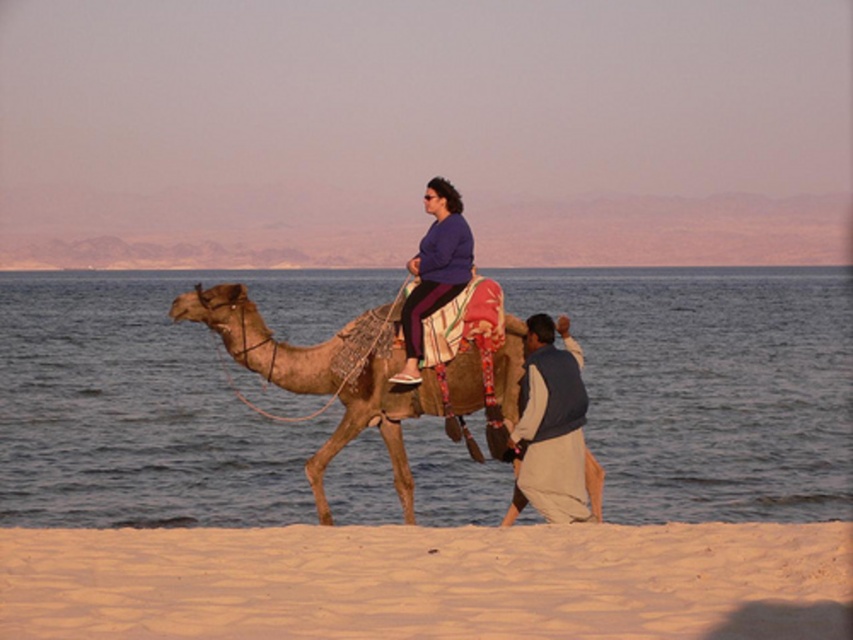
Which of these two, sandy beige at lower center or purple fabric at center, stands shorter?

sandy beige at lower center

The height and width of the screenshot is (640, 853). I want to click on sandy beige at lower center, so click(x=428, y=582).

Describe the element at coordinates (428, 582) in the screenshot. I see `sandy beige at lower center` at that location.

The height and width of the screenshot is (640, 853). I want to click on sandy beige at lower center, so click(x=428, y=582).

Is smooth sand at lower center to the right of purple fabric at center from the viewer's perspective?

In fact, smooth sand at lower center is to the left of purple fabric at center.

Which of these two, smooth sand at lower center or purple fabric at center, stands taller?

With more height is smooth sand at lower center.

Looking at this image, measure the distance between smooth sand at lower center and camera.

The distance of smooth sand at lower center from camera is 26.76 meters.

Image resolution: width=853 pixels, height=640 pixels. I want to click on smooth sand at lower center, so point(151,401).

Can you confirm if beige cotton pants at lower right is positioned to the left of purple fabric at center?

In fact, beige cotton pants at lower right is to the right of purple fabric at center.

In order to click on beige cotton pants at lower right in this screenshot , I will do `click(550, 426)`.

What do you see at coordinates (550, 426) in the screenshot? I see `beige cotton pants at lower right` at bounding box center [550, 426].

This screenshot has width=853, height=640. What are the coordinates of `beige cotton pants at lower right` in the screenshot? It's located at [x=550, y=426].